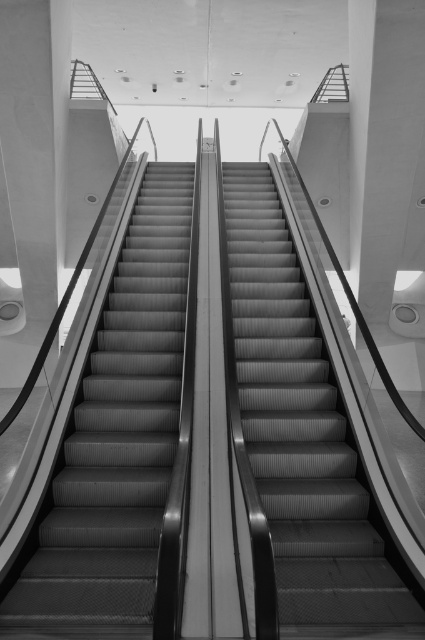
Does metallic gray stairs at left have a greater height compared to metallic gray escalator at center?

Correct, metallic gray stairs at left is much taller as metallic gray escalator at center.

Who is taller, metallic gray stairs at left or metallic gray escalator at center?

Standing taller between the two is metallic gray stairs at left.

Which is in front, point (158, 310) or point (289, 401)?

Point (289, 401) is more forward.

The height and width of the screenshot is (640, 425). Find the location of `metallic gray stairs at left`. metallic gray stairs at left is located at coordinates (118, 440).